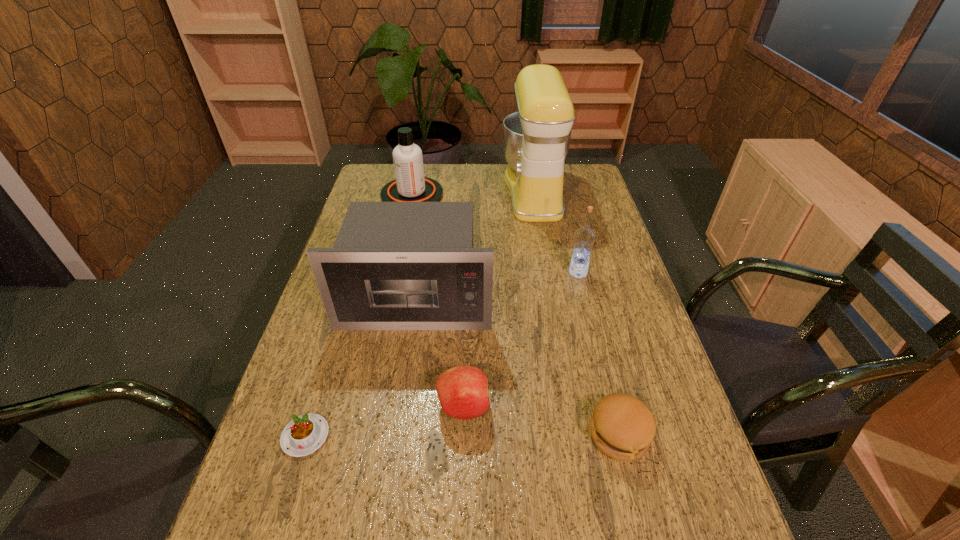
Locate an element on the screen. The height and width of the screenshot is (540, 960). empty location between the hamburger and the vodka is located at coordinates (598, 354).

Find the location of a particular element. free spot between the apple and the mixer is located at coordinates (499, 299).

You are a GUI agent. You are given a task and a screenshot of the screen. Output one action in this format:
    pyautogui.click(x=<x>, y=<y>)
    Task: Click on the free space between the fifth tallest object and the microwave oven
    This screenshot has height=540, width=960.
    Given the screenshot: What is the action you would take?
    [440, 354]

You are a GUI agent. You are given a task and a screenshot of the screen. Output one action in this format:
    pyautogui.click(x=<x>, y=<y>)
    Task: Click on the free area in between the hamburger and the mixer
    The height and width of the screenshot is (540, 960).
    Given the screenshot: What is the action you would take?
    pyautogui.click(x=577, y=313)

Identify the location of free spot between the microwave oven and the shortest object. (361, 368).

Image resolution: width=960 pixels, height=540 pixels. I want to click on vacant space that is in between the mixer and the vodka, so click(556, 232).

This screenshot has width=960, height=540. I want to click on vacant space that is in between the apple and the second shortest object, so click(541, 421).

What are the coordinates of `the fourth closest object to the apple` in the screenshot? It's located at (584, 237).

Locate an element on the screen. The image size is (960, 540). object that stands as the second closest to the pudding is located at coordinates (394, 265).

This screenshot has height=540, width=960. What are the coordinates of `free spot that satisfies the following two spatial constraints: 1. on the front side of the cleansing agent; 2. on the right side of the vodka` in the screenshot? It's located at (396, 273).